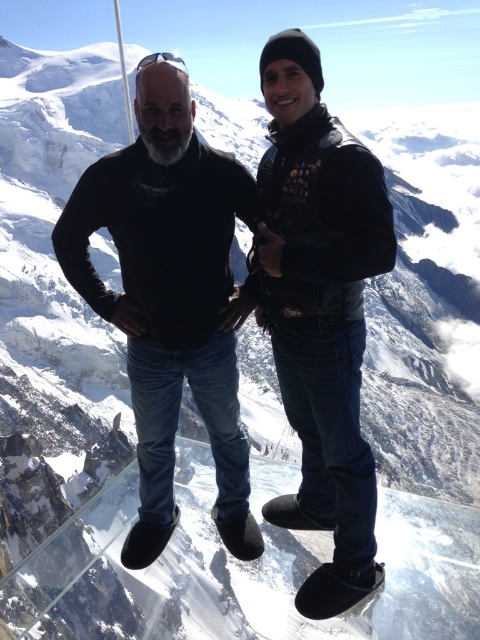
You are a photographer planning to take a photo of the two people wearing the black matte sweater at center and the black leather jacket at center. Since you want to capture their full bodies, you need to know which clothing item is wider to ensure proper framing. Which one has a greater width?

The black matte sweater at center has a greater width than the black leather jacket at center.

You are a photographer planning to take a portrait of the two people wearing the black matte sweater at center and the black leather jacket at center. Based on their clothing heights, which one should you position closer to the camera to make them appear more prominent?

The black matte sweater at center has a lesser height compared to the black leather jacket at center. To make them appear more prominent, position the black matte sweater at center closer to the camera since its smaller size can be emphasized by proximity.